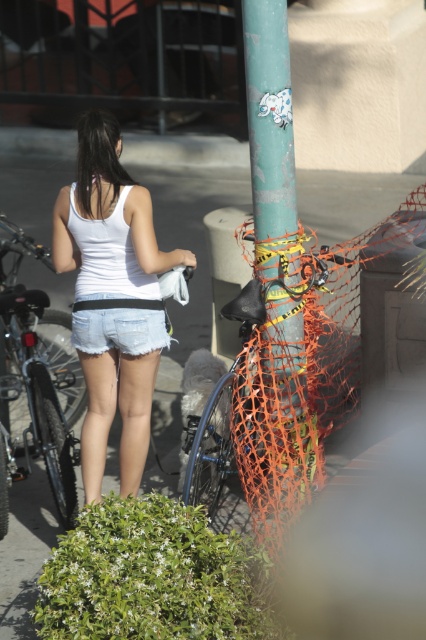
Question: Can you confirm if green matte pole at center is bigger than denim shorts at center?

Choices:
 (A) yes
 (B) no

Answer: (A)

Question: Does shiny metallic bicycle at left have a larger size compared to denim shorts at center?

Choices:
 (A) no
 (B) yes

Answer: (B)

Question: Is green matte pole at center in front of denim shorts at center?

Choices:
 (A) yes
 (B) no

Answer: (A)

Question: Estimate the real-world distances between objects in this image. Which object is farther from the shiny metallic bicycle at left?

Choices:
 (A) white denim shorts at center
 (B) denim shorts at center

Answer: (B)

Question: Which of the following is the farthest from the observer?

Choices:
 (A) (275, 317)
 (B) (80, 321)

Answer: (A)

Question: Which object appears farthest from the camera in this image?

Choices:
 (A) green matte pole at center
 (B) shiny metallic bicycle at left
 (C) white denim shorts at center
 (D) denim shorts at center

Answer: (B)